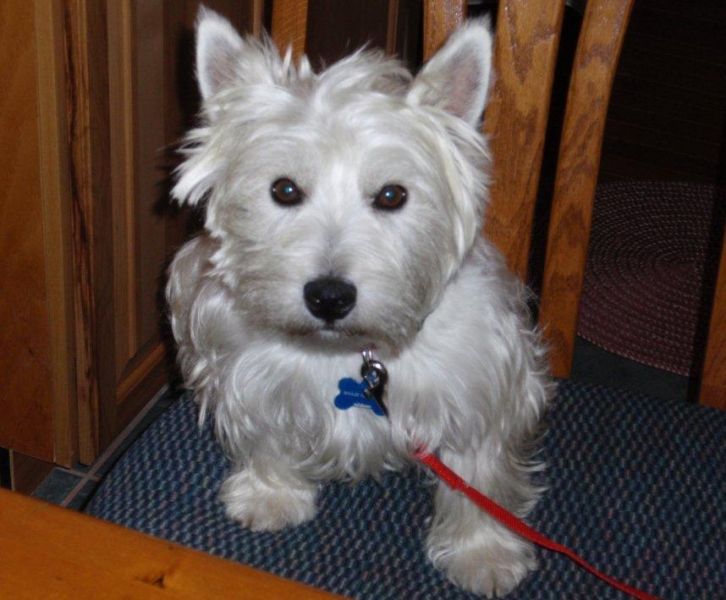
What are the coordinates of `pendant` in the screenshot? It's located at (350, 396).